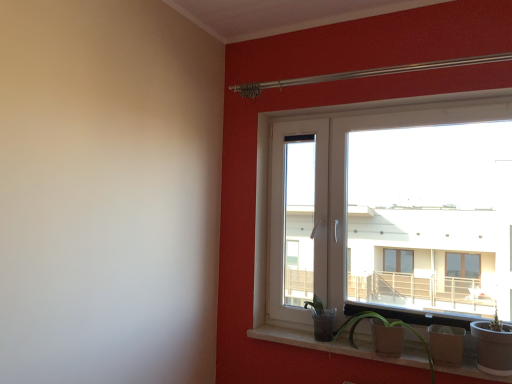
Question: From the image's perspective, is white plastic window at upper right below matte concrete window sill at lower center?

Choices:
 (A) no
 (B) yes

Answer: (A)

Question: Is white plastic window at upper right at the left side of matte concrete window sill at lower center?

Choices:
 (A) no
 (B) yes

Answer: (A)

Question: Is white plastic window at upper right wider than matte concrete window sill at lower center?

Choices:
 (A) yes
 (B) no

Answer: (B)

Question: Can you confirm if white plastic window at upper right is shorter than matte concrete window sill at lower center?

Choices:
 (A) yes
 (B) no

Answer: (B)

Question: Is white plastic window at upper right outside of matte concrete window sill at lower center?

Choices:
 (A) no
 (B) yes

Answer: (B)

Question: Visually, is matte brown pot at lower right positioned to the left or to the right of white plastic window at upper right?

Choices:
 (A) left
 (B) right

Answer: (A)

Question: Considering their positions, is matte brown pot at lower right located in front of or behind white plastic window at upper right?

Choices:
 (A) behind
 (B) front

Answer: (B)

Question: Is matte brown pot at lower right inside or outside of white plastic window at upper right?

Choices:
 (A) inside
 (B) outside

Answer: (B)

Question: Is matte brown pot at lower right taller or shorter than white plastic window at upper right?

Choices:
 (A) short
 (B) tall

Answer: (A)

Question: Looking at their shapes, would you say matte brown pot at lower right is wider or thinner than matte concrete window sill at lower center?

Choices:
 (A) thin
 (B) wide

Answer: (B)

Question: Is matte brown pot at lower right in front of or behind matte concrete window sill at lower center in the image?

Choices:
 (A) behind
 (B) front

Answer: (B)

Question: Considering the positions of point (382, 319) and point (395, 359), is point (382, 319) closer or farther from the camera than point (395, 359)?

Choices:
 (A) farther
 (B) closer

Answer: (A)

Question: From a real-world perspective, is matte brown pot at lower right positioned above or below matte concrete window sill at lower center?

Choices:
 (A) below
 (B) above

Answer: (B)

Question: From a real-world perspective, relative to matte concrete window sill at lower center, is white plastic window at upper right vertically above or below?

Choices:
 (A) above
 (B) below

Answer: (A)

Question: Considering their positions, is white plastic window at upper right located in front of or behind matte concrete window sill at lower center?

Choices:
 (A) behind
 (B) front

Answer: (A)